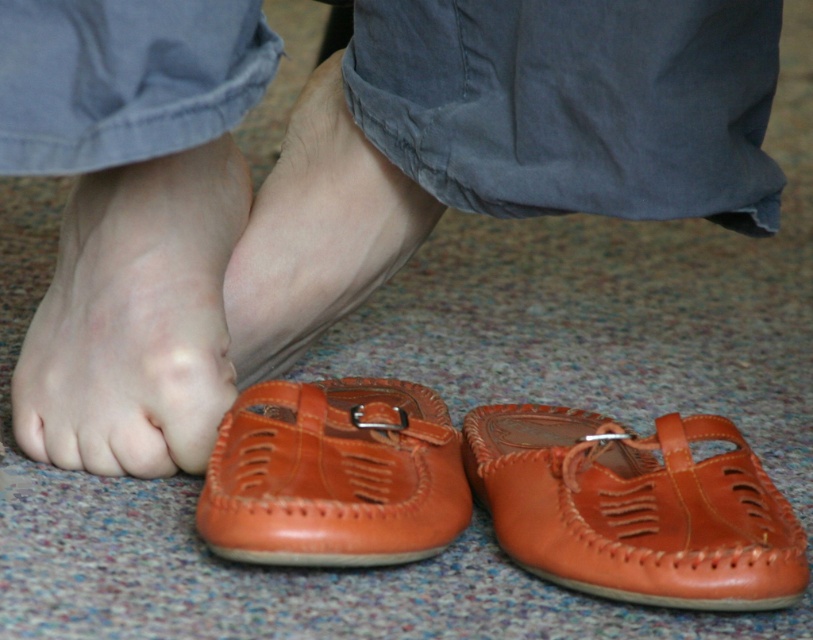
Question: Is brown leather shoe at lower right bigger than brown leather shoe at lower center?

Choices:
 (A) no
 (B) yes

Answer: (B)

Question: Which point appears closest to the camera in this image?

Choices:
 (A) (711, 538)
 (B) (164, 262)
 (C) (442, 492)

Answer: (A)

Question: Which of the following is the farthest from the observer?

Choices:
 (A) leather shoes at lower center
 (B) brown leather shoe at lower center
 (C) leather at center

Answer: (C)

Question: Based on their relative distances, which object is farther from the leather shoes at lower center?

Choices:
 (A) leather at center
 (B) brown leather shoe at lower center

Answer: (B)

Question: Is leather shoes at lower center thinner than brown leather shoe at lower right?

Choices:
 (A) no
 (B) yes

Answer: (A)

Question: Can you confirm if matte orange leather foot at lower left is bigger than brown leather shoe at lower center?

Choices:
 (A) no
 (B) yes

Answer: (B)